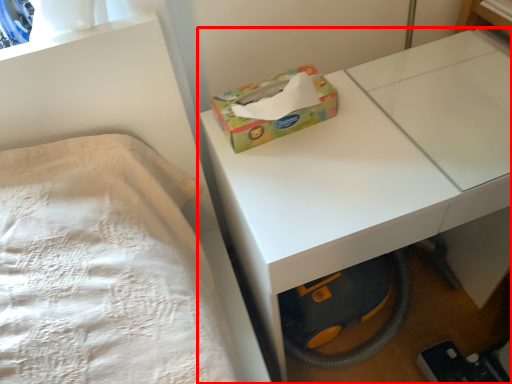
Question: From the image's perspective, considering the relative positions of table (annotated by the red box) and box in the image provided, where is table (annotated by the red box) located with respect to the staircase?

Choices:
 (A) above
 (B) below

Answer: (B)